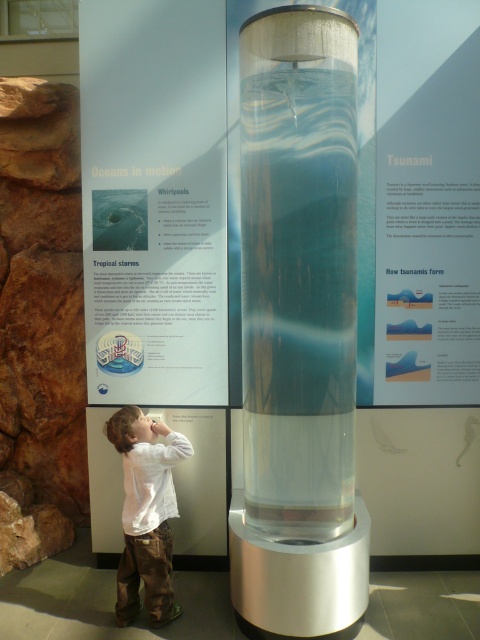
Does matte white poster at upper left appear on the left side of white paper at upper right?

Correct, you'll find matte white poster at upper left to the left of white paper at upper right.

Which is in front, point (121, 17) or point (409, 20)?

Positioned in front is point (409, 20).

Find the location of `matte white poster at upper left`. matte white poster at upper left is located at coordinates (x=154, y=200).

Who is more forward, (156, 68) or (164, 449)?

Point (164, 449)

Between matte white poster at upper left and white cotton shirt at lower left, which one is positioned higher?

Positioned higher is matte white poster at upper left.

The image size is (480, 640). In order to click on matte white poster at upper left in this screenshot , I will do `click(154, 200)`.

Is white paper at upper right below white cotton shirt at lower left?

No.

This screenshot has height=640, width=480. Find the location of `white paper at upper right`. white paper at upper right is located at coordinates (427, 204).

Is point (412, 108) positioned before point (142, 522)?

No, it is not.

I want to click on white paper at upper right, so click(x=427, y=204).